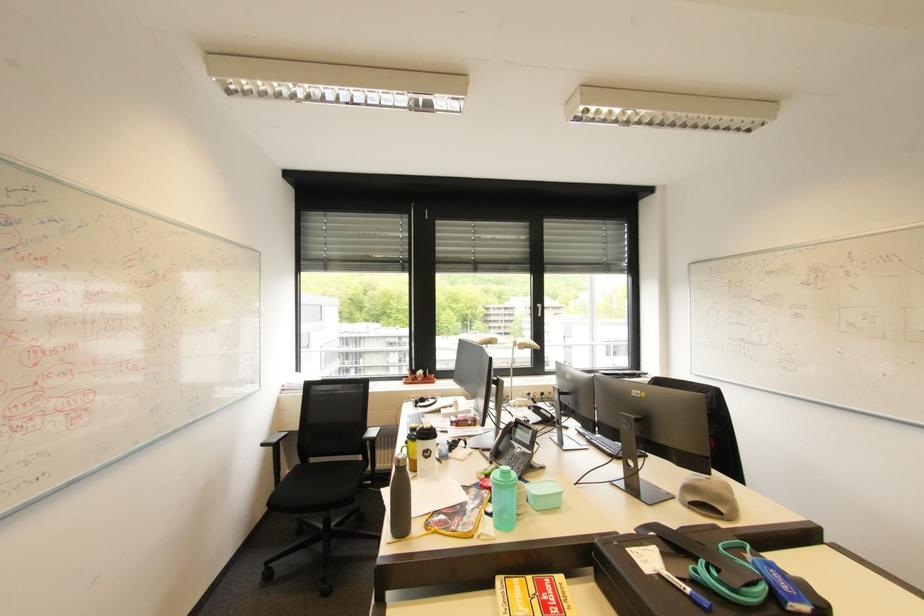
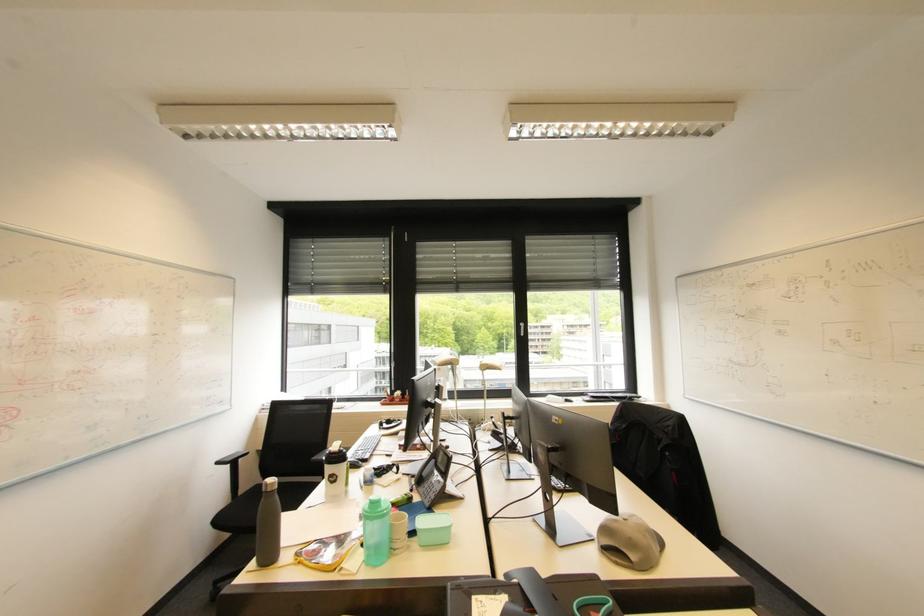
Question: How did the camera likely rotate?

Choices:
 (A) Left
 (B) Right
 (C) Up
 (D) Down

Answer: (A)